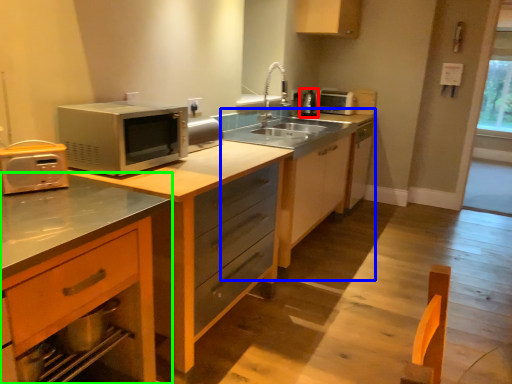
Question: Which object is positioned farthest from appliance (highlighted by a red box)? Select from dresser (highlighted by a blue box) and cabinetry (highlighted by a green box).

Choices:
 (A) dresser
 (B) cabinetry

Answer: (B)